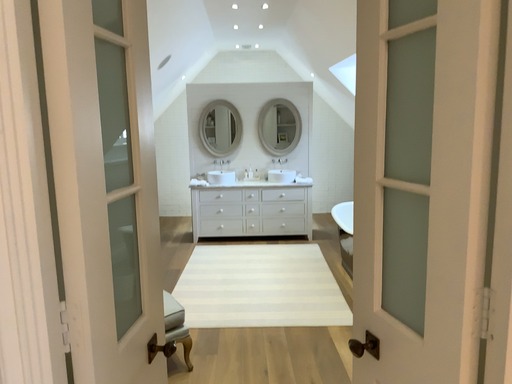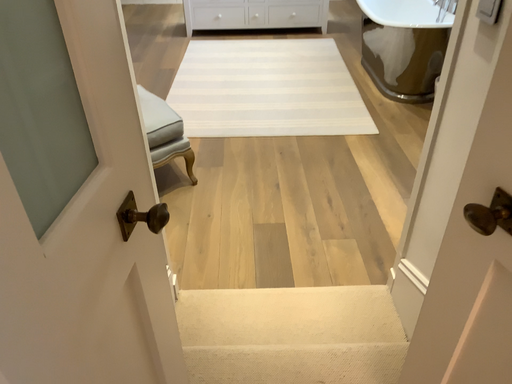
Question: Which way did the camera rotate in the video?

Choices:
 (A) rotated downward
 (B) rotated upward

Answer: (A)